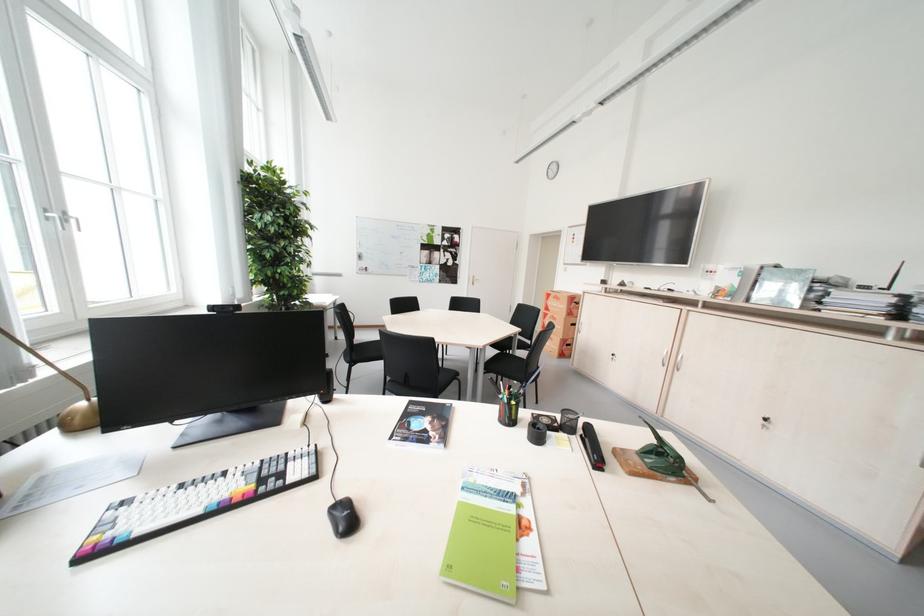
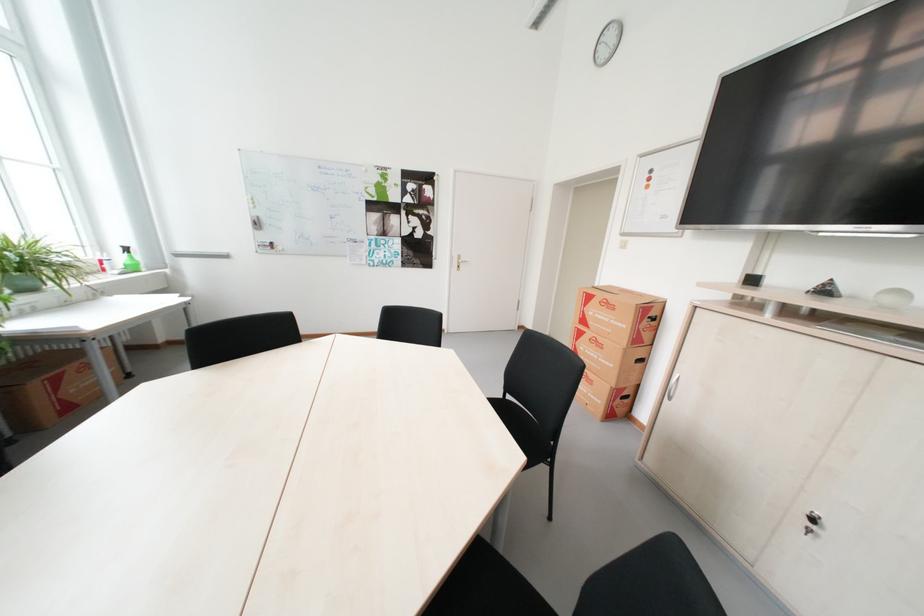
The point at (561, 299) is marked in the first image. Where is the corresponding point in the second image?

(604, 302)